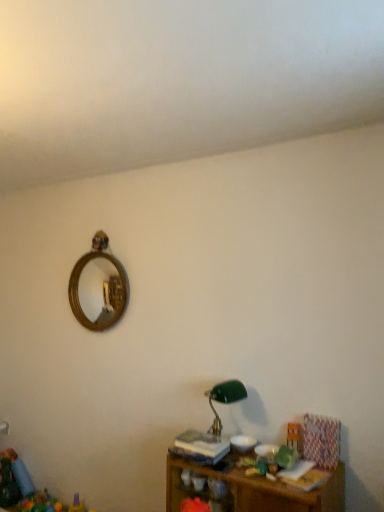
Question: From the image's perspective, relative to wooden shelf at lower right, is wooden toy at lower right above or below?

Choices:
 (A) below
 (B) above

Answer: (B)

Question: From a real-world perspective, is wooden toy at lower right physically located above or below wooden shelf at lower right?

Choices:
 (A) below
 (B) above

Answer: (B)

Question: Estimate the real-world distances between objects in this image. Which object is closer to the green glass table lamp at lower center?

Choices:
 (A) wooden toy at lower right
 (B) wooden shelf at lower right

Answer: (A)

Question: Which is nearer to the green glass table lamp at lower center?

Choices:
 (A) wooden toy at lower right
 (B) wooden shelf at lower right

Answer: (A)